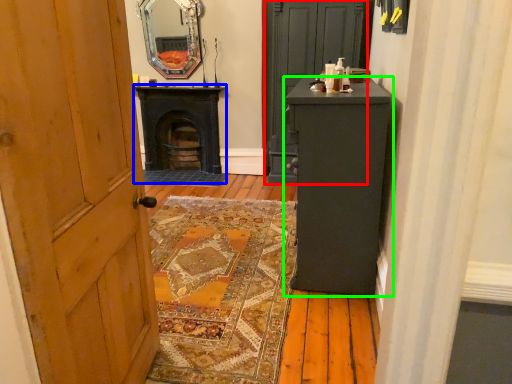
Question: Estimate the real-world distances between objects in this image. Which object is farther from door (highlighted by a red box), stove (highlighted by a blue box) or furniture (highlighted by a green box)?

Choices:
 (A) stove
 (B) furniture

Answer: (B)